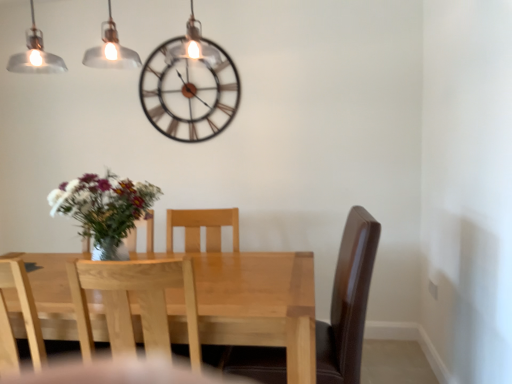
Question: Is light wood chair at left, the 2th chair positioned from the right, positioned far away from light wood table at center?

Choices:
 (A) no
 (B) yes

Answer: (B)

Question: From a real-world perspective, is light wood chair at left, the 2th chair positioned from the right, beneath light wood table at center?

Choices:
 (A) no
 (B) yes

Answer: (A)

Question: Can you confirm if light wood chair at left, the 2th chair positioned from the right, is thinner than light wood table at center?

Choices:
 (A) no
 (B) yes

Answer: (B)

Question: Does light wood chair at left, the 2th chair positioned from the right, have a greater width compared to light wood table at center?

Choices:
 (A) no
 (B) yes

Answer: (A)

Question: Is light wood chair at left, the 2th chair positioned from the right, positioned with its back to light wood table at center?

Choices:
 (A) yes
 (B) no

Answer: (A)

Question: Would you say light wood table at center is inside or outside metallic brown clock at upper center?

Choices:
 (A) outside
 (B) inside

Answer: (A)

Question: Looking at their shapes, would you say light wood table at center is wider or thinner than metallic brown clock at upper center?

Choices:
 (A) thin
 (B) wide

Answer: (B)

Question: From their relative heights in the image, would you say light wood table at center is taller or shorter than metallic brown clock at upper center?

Choices:
 (A) tall
 (B) short

Answer: (A)

Question: Relative to metallic brown clock at upper center, is light wood table at center in front or behind?

Choices:
 (A) front
 (B) behind

Answer: (A)

Question: Considering the relative positions of light wood table at center and light wood chair at left, the 2th chair positioned from the right, in the image provided, is light wood table at center to the left or to the right of light wood chair at left, the 2th chair positioned from the right,?

Choices:
 (A) left
 (B) right

Answer: (B)

Question: Is point (244, 281) closer or farther from the camera than point (16, 364)?

Choices:
 (A) farther
 (B) closer

Answer: (B)

Question: In terms of height, does light wood table at center look taller or shorter compared to light wood chair at left, acting as the 1th chair starting from the left?

Choices:
 (A) tall
 (B) short

Answer: (A)

Question: From a real-world perspective, is light wood table at center above or below light wood chair at left, the 2th chair positioned from the right?

Choices:
 (A) above
 (B) below

Answer: (B)

Question: Based on their positions, is light wood chair at left, acting as the 1th chair starting from the left, located to the left or right of metallic brown clock at upper center?

Choices:
 (A) left
 (B) right

Answer: (A)

Question: Is point (10, 273) closer or farther from the camera than point (234, 72)?

Choices:
 (A) closer
 (B) farther

Answer: (B)